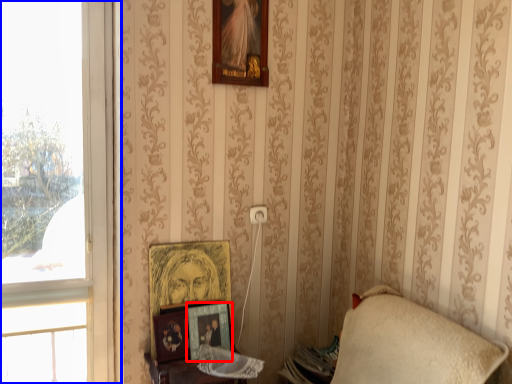
Question: Which of the following is the closest to the observer, picture frame (highlighted by a red box) or window (highlighted by a blue box)?

Choices:
 (A) picture frame
 (B) window

Answer: (B)